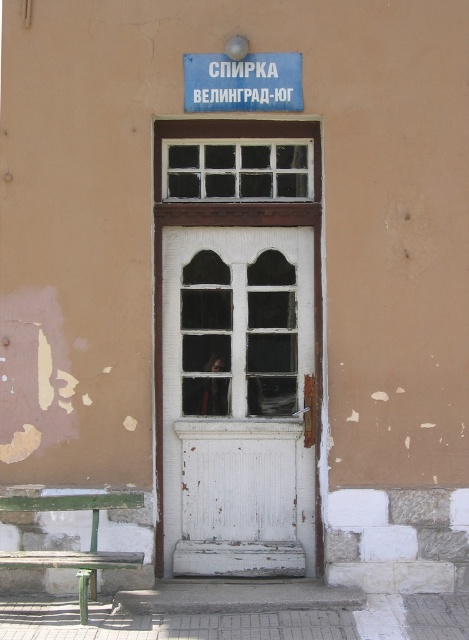
Question: Can you confirm if white wooden door at center is positioned below blue painted metal sign at upper center?

Choices:
 (A) yes
 (B) no

Answer: (A)

Question: Among these points, which one is farthest from the camera?

Choices:
 (A) (229, 156)
 (B) (235, 84)

Answer: (A)

Question: Among these objects, which one is nearest to the camera?

Choices:
 (A) white wooden door at center
 (B) white wooden window at center

Answer: (A)

Question: Can you confirm if white wooden door at center is bigger than white wooden window at center?

Choices:
 (A) no
 (B) yes

Answer: (B)

Question: Does white wooden window at center have a larger size compared to blue painted metal sign at upper center?

Choices:
 (A) no
 (B) yes

Answer: (B)

Question: Which of the following is the farthest from the observer?

Choices:
 (A) pos(239,108)
 (B) pos(287,273)

Answer: (B)